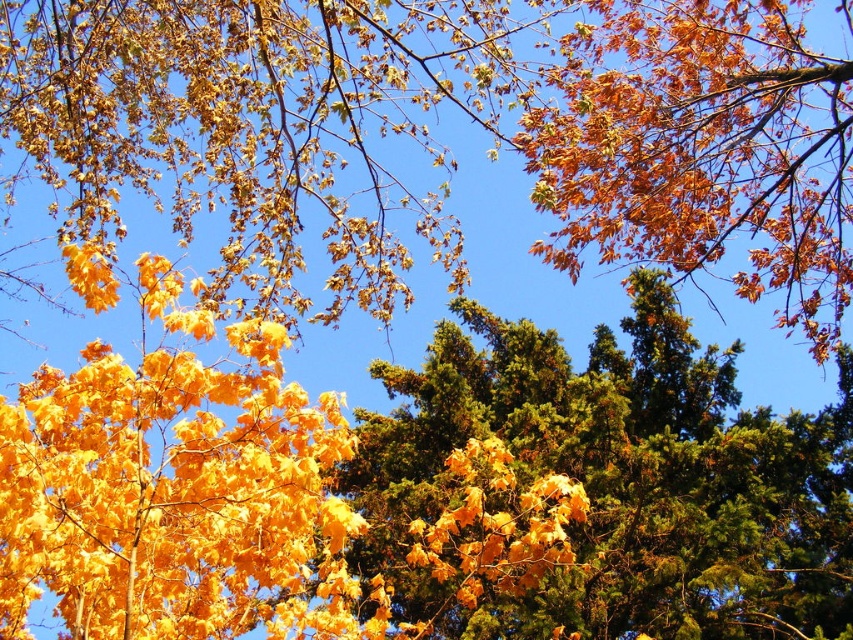
Question: Is green textured pine tree at center positioned in front of shiny golden leaves at left?

Choices:
 (A) yes
 (B) no

Answer: (B)

Question: Which of the following is the farthest from the observer?

Choices:
 (A) green textured pine tree at center
 (B) shiny golden leaves at left

Answer: (A)

Question: Which object appears closest to the camera in this image?

Choices:
 (A) green textured pine tree at center
 (B) shiny golden leaves at left

Answer: (B)

Question: Among these objects, which one is farthest from the camera?

Choices:
 (A) shiny golden leaves at left
 (B) green textured pine tree at center

Answer: (B)

Question: Observing the image, what is the correct spatial positioning of green textured pine tree at center in reference to shiny golden leaves at left?

Choices:
 (A) above
 (B) below

Answer: (A)

Question: Is green textured pine tree at center further to camera compared to shiny golden leaves at left?

Choices:
 (A) yes
 (B) no

Answer: (A)